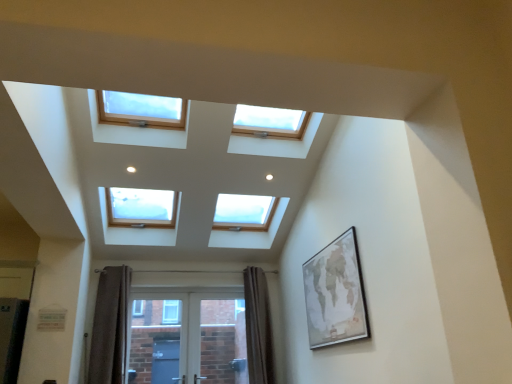
Question: Would you say brown velvet curtain at lower left, acting as the 1th curtain starting from the left, is part of wooden-framed map at right's contents?

Choices:
 (A) no
 (B) yes

Answer: (A)

Question: Does wooden-framed map at right come in front of brown velvet curtain at lower left, marked as the 2th curtain in a right-to-left arrangement?

Choices:
 (A) no
 (B) yes

Answer: (B)

Question: Is wooden-framed map at right in contact with brown velvet curtain at lower left, marked as the 2th curtain in a right-to-left arrangement?

Choices:
 (A) yes
 (B) no

Answer: (B)

Question: Is wooden-framed map at right shorter than brown velvet curtain at lower left, marked as the 2th curtain in a right-to-left arrangement?

Choices:
 (A) yes
 (B) no

Answer: (A)

Question: From a real-world perspective, is wooden-framed map at right on brown velvet curtain at lower left, marked as the 2th curtain in a right-to-left arrangement?

Choices:
 (A) yes
 (B) no

Answer: (A)

Question: Could you tell me if wooden-framed map at right is facing brown velvet curtain at lower left, marked as the 2th curtain in a right-to-left arrangement?

Choices:
 (A) yes
 (B) no

Answer: (B)

Question: From a real-world perspective, is brown textured curtain at lower center, marked as the 2th curtain in a left-to-right arrangement, on white glossy screen door at lower center?

Choices:
 (A) no
 (B) yes

Answer: (B)

Question: Can you confirm if brown textured curtain at lower center, which ranks as the first curtain in right-to-left order, is positioned to the right of white glossy screen door at lower center?

Choices:
 (A) no
 (B) yes

Answer: (B)

Question: Could you tell me if brown textured curtain at lower center, marked as the 2th curtain in a left-to-right arrangement, is facing white glossy screen door at lower center?

Choices:
 (A) yes
 (B) no

Answer: (B)

Question: From the image's perspective, does brown textured curtain at lower center, marked as the 2th curtain in a left-to-right arrangement, appear higher than white glossy screen door at lower center?

Choices:
 (A) yes
 (B) no

Answer: (A)

Question: Is brown textured curtain at lower center, which ranks as the first curtain in right-to-left order, looking in the opposite direction of white glossy screen door at lower center?

Choices:
 (A) no
 (B) yes

Answer: (A)

Question: Does brown textured curtain at lower center, marked as the 2th curtain in a left-to-right arrangement, contain white glossy screen door at lower center?

Choices:
 (A) no
 (B) yes

Answer: (A)

Question: Considering the relative positions of wooden-framed map at right and brown textured curtain at lower center, which ranks as the first curtain in right-to-left order, in the image provided, is wooden-framed map at right behind brown textured curtain at lower center, which ranks as the first curtain in right-to-left order,?

Choices:
 (A) no
 (B) yes

Answer: (A)